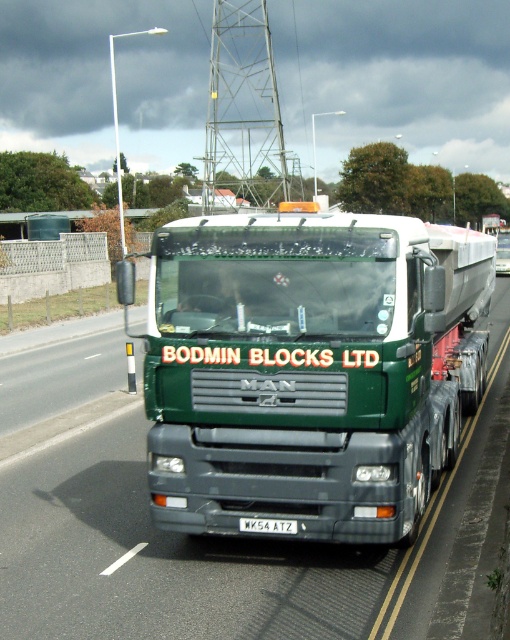
Who is taller, green matte truck at center or white metallic license plate at center?

green matte truck at center is taller.

Is green matte truck at center to the right of white metallic license plate at center from the viewer's perspective?

Correct, you'll find green matte truck at center to the right of white metallic license plate at center.

Locate an element on the screen. This screenshot has height=640, width=510. green matte truck at center is located at coordinates (310, 369).

The width and height of the screenshot is (510, 640). I want to click on green matte truck at center, so click(x=310, y=369).